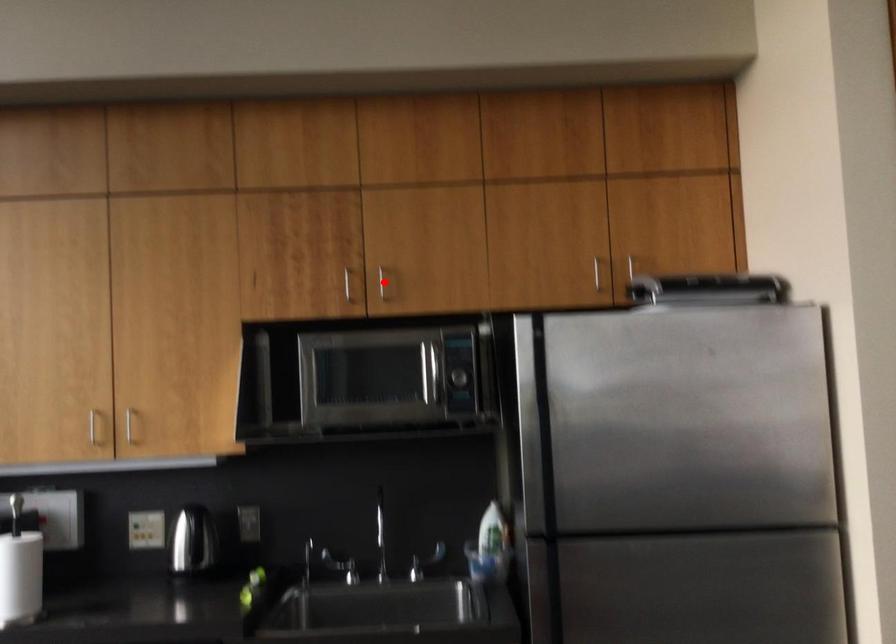
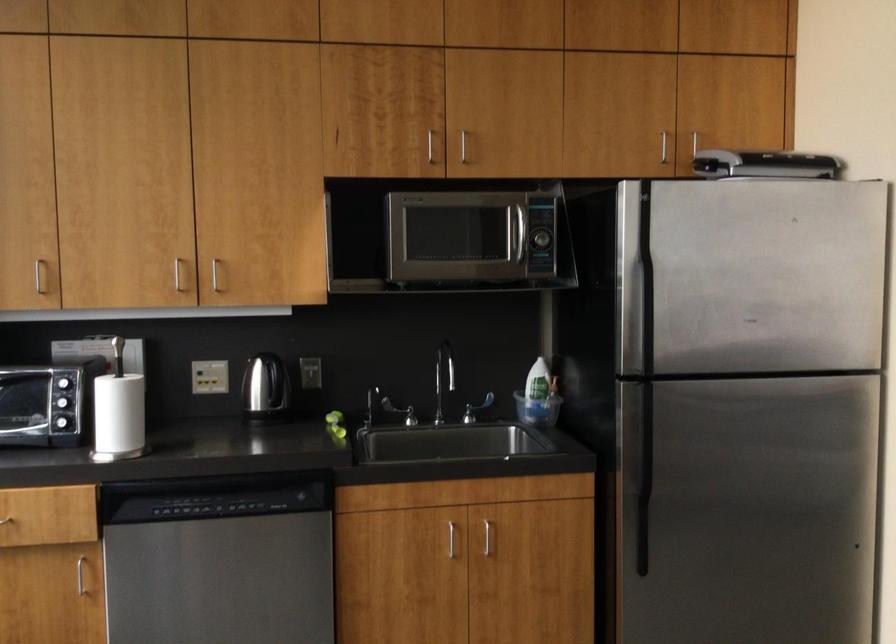
The point at the highlighted location is marked in the first image. Where is the corresponding point in the second image?

(462, 146)